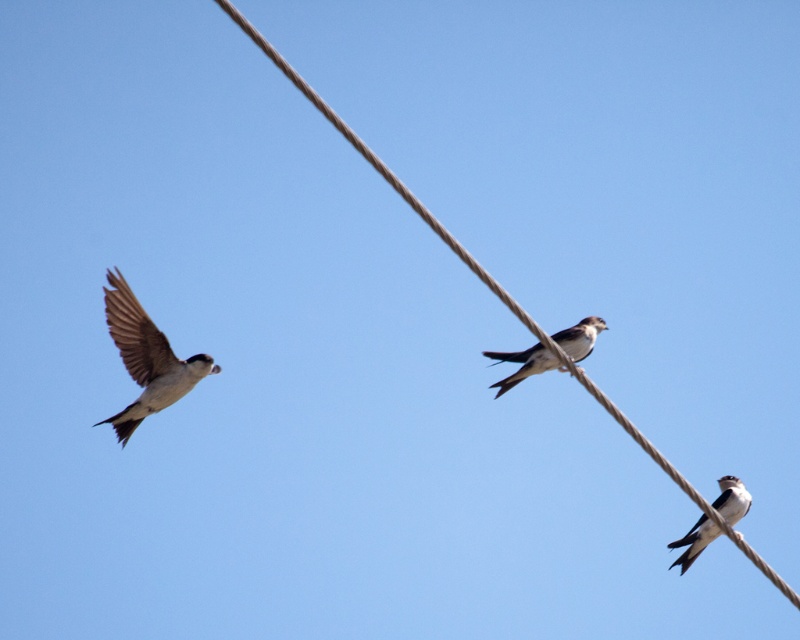
You are an ornithologist observing birds on a wire. You notice a white glossy swallow at center and a white matte bird at center. Which bird is positioned closer to the left side of the wire?

The white glossy swallow at center is positioned to the left of the white matte bird at center, so it is closer to the left side of the wire.